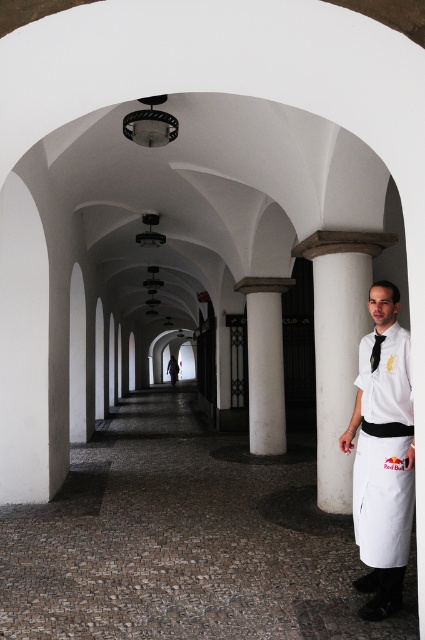
Question: Does white matte uniform at right appear over white smooth column at center?

Choices:
 (A) yes
 (B) no

Answer: (B)

Question: Among these objects, which one is farthest from the camera?

Choices:
 (A) white smooth column at center
 (B) white matte uniform at right
 (C) white smooth column at right
 (D) black silk tie at right

Answer: (A)

Question: Is white smooth column at right to the right of white smooth column at center from the viewer's perspective?

Choices:
 (A) yes
 (B) no

Answer: (A)

Question: Does white smooth column at right have a larger size compared to white smooth column at center?

Choices:
 (A) yes
 (B) no

Answer: (A)

Question: Which of these objects is positioned farthest from the white matte uniform at right?

Choices:
 (A) white smooth column at center
 (B) white smooth column at right
 (C) black silk tie at right

Answer: (A)

Question: Which object appears farthest from the camera in this image?

Choices:
 (A) white smooth column at right
 (B) white smooth column at center

Answer: (B)